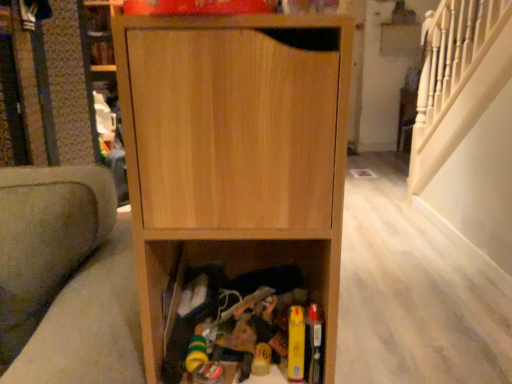
Question: In terms of size, does natural wood cabinet at center appear bigger or smaller than soft gray fabric armchair at left?

Choices:
 (A) big
 (B) small

Answer: (B)

Question: In terms of width, does natural wood cabinet at center look wider or thinner when compared to soft gray fabric armchair at left?

Choices:
 (A) wide
 (B) thin

Answer: (B)

Question: Is natural wood cabinet at center in front of or behind soft gray fabric armchair at left in the image?

Choices:
 (A) behind
 (B) front

Answer: (A)

Question: From the image's perspective, relative to natural wood cabinet at center, is soft gray fabric armchair at left above or below?

Choices:
 (A) below
 (B) above

Answer: (A)

Question: Is soft gray fabric armchair at left wider or thinner than natural wood cabinet at center?

Choices:
 (A) thin
 (B) wide

Answer: (B)

Question: Is soft gray fabric armchair at left taller or shorter than natural wood cabinet at center?

Choices:
 (A) tall
 (B) short

Answer: (A)

Question: Is soft gray fabric armchair at left in front of or behind natural wood cabinet at center in the image?

Choices:
 (A) front
 (B) behind

Answer: (A)